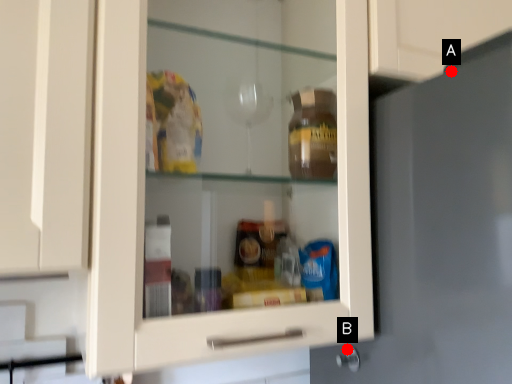
Question: Two points are circled on the image, labeled by A and B beside each circle. Which point is closer to the camera?

Choices:
 (A) A is closer
 (B) B is closer

Answer: (A)